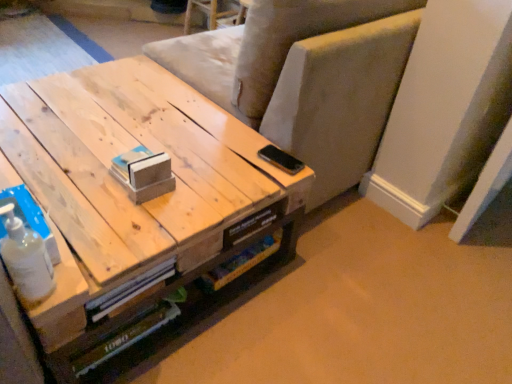
Identify the location of light beige fabric armchair at upper center. This screenshot has width=512, height=384. [341, 92].

In order to face natural wood table at center, should I rotate leftwards or rightwards?

You should rotate left by 18.770 degrees.

Locate an element on the screen. This screenshot has width=512, height=384. light beige fabric armchair at upper center is located at coordinates (341, 92).

Is natural wood table at center further to camera compared to light beige fabric armchair at upper center?

No.

From the image's perspective, would you say natural wood table at center is shown under light beige fabric armchair at upper center?

Indeed, from the image's perspective, natural wood table at center is shown beneath light beige fabric armchair at upper center.

Considering the relative positions of natural wood table at center and light beige fabric armchair at upper center in the image provided, is natural wood table at center to the right of light beige fabric armchair at upper center from the viewer's perspective?

No, natural wood table at center is not to the right of light beige fabric armchair at upper center.

Considering the points (234, 250) and (276, 110), which point is in front, point (234, 250) or point (276, 110)?

The point (234, 250) is in front.

Can you tell me how much white matte bottle at lower left and light beige fabric armchair at upper center differ in facing direction?

The angular difference between white matte bottle at lower left and light beige fabric armchair at upper center is 89 degrees.

Is white matte bottle at lower left looking in the opposite direction of light beige fabric armchair at upper center?

That's not correct — white matte bottle at lower left is not looking away from light beige fabric armchair at upper center.

Based on their positions, is white matte bottle at lower left located to the left or right of light beige fabric armchair at upper center?

white matte bottle at lower left is to the left of light beige fabric armchair at upper center.

How much distance is there between white matte bottle at lower left and light beige fabric armchair at upper center?

white matte bottle at lower left and light beige fabric armchair at upper center are 37.85 inches apart.

Considering the sizes of objects white matte bottle at lower left and natural wood table at center in the image provided, who is smaller, white matte bottle at lower left or natural wood table at center?

With smaller size is white matte bottle at lower left.

Does point (15, 279) come behind point (282, 227)?

That is False.

Considering the sizes of objects white matte bottle at lower left and natural wood table at center in the image provided, who is wider, white matte bottle at lower left or natural wood table at center?

natural wood table at center is wider.

Is there a large distance between white matte bottle at lower left and natural wood table at center?

No, white matte bottle at lower left is not far away from natural wood table at center.

Considering the positions of objects light beige fabric armchair at upper center and white matte bottle at lower left in the image provided, who is in front, light beige fabric armchair at upper center or white matte bottle at lower left?

white matte bottle at lower left.

You are a GUI agent. You are given a task and a screenshot of the screen. Output one action in this format:
    pyautogui.click(x=<x>, y=<y>)
    Task: Click on the armchair below the white matte bottle at lower left (from a real-world perspective)
    The width and height of the screenshot is (512, 384).
    Given the screenshot: What is the action you would take?
    pyautogui.click(x=341, y=92)

Would you say light beige fabric armchair at upper center contains white matte bottle at lower left?

Definitely not — white matte bottle at lower left is not inside light beige fabric armchair at upper center.

Can you tell me how much light beige fabric armchair at upper center and white matte bottle at lower left differ in facing direction?

They differ by 89 degrees in their facing directions.

Is light beige fabric armchair at upper center in front of natural wood table at center?

No, light beige fabric armchair at upper center is further to the viewer.

From the image's perspective, between light beige fabric armchair at upper center and natural wood table at center, who is located below?

From the image's view, natural wood table at center is below.

Does light beige fabric armchair at upper center have a lesser width compared to natural wood table at center?

Correct, the width of light beige fabric armchair at upper center is less than that of natural wood table at center.

Is light beige fabric armchair at upper center aimed at natural wood table at center?

No, light beige fabric armchair at upper center is not facing towards natural wood table at center.

Is natural wood table at center wider or thinner than white matte bottle at lower left?

Considering their sizes, natural wood table at center looks broader than white matte bottle at lower left.

From a real-world perspective, which object rests below the other?

natural wood table at center is physically lower.

Is natural wood table at center spatially inside white matte bottle at lower left, or outside of it?

natural wood table at center is spatially situated outside white matte bottle at lower left.

Is natural wood table at center facing towards white matte bottle at lower left?

No.

At what (x,y) coordinates should I click in order to perform the action: click on table below the light beige fabric armchair at upper center (from a real-world perspective). Please return your answer as a coordinate pair (x, y). The width and height of the screenshot is (512, 384). Looking at the image, I should click on (128, 192).

Identify the location of armchair behind the white matte bottle at lower left. (341, 92).

Which object lies further to the anchor point light beige fabric armchair at upper center, natural wood table at center or white matte bottle at lower left?

The object further to light beige fabric armchair at upper center is white matte bottle at lower left.

Based on their spatial positions, is light beige fabric armchair at upper center or white matte bottle at lower left closer to natural wood table at center?

light beige fabric armchair at upper center is closer to natural wood table at center.

From the image, which object appears to be farther from natural wood table at center, white matte bottle at lower left or light beige fabric armchair at upper center?

Based on the image, white matte bottle at lower left appears to be further to natural wood table at center.

Considering their positions, is natural wood table at center positioned further to white matte bottle at lower left than light beige fabric armchair at upper center?

light beige fabric armchair at upper center lies further to white matte bottle at lower left than the other object.

In the scene shown: Based on their spatial positions, is light beige fabric armchair at upper center or natural wood table at center further from white matte bottle at lower left?

Based on the image, light beige fabric armchair at upper center appears to be further to white matte bottle at lower left.

Based on their spatial positions, is white matte bottle at lower left or natural wood table at center further from light beige fabric armchair at upper center?

white matte bottle at lower left.

Identify the location of bottle situated between natural wood table at center and light beige fabric armchair at upper center from left to right. This screenshot has height=384, width=512. (26, 259).